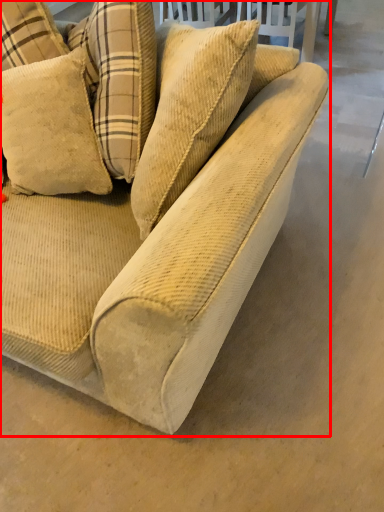
Question: From the image's perspective, what is the correct spatial positioning of studio couch (annotated by the red box) in reference to pillow?

Choices:
 (A) above
 (B) below

Answer: (B)